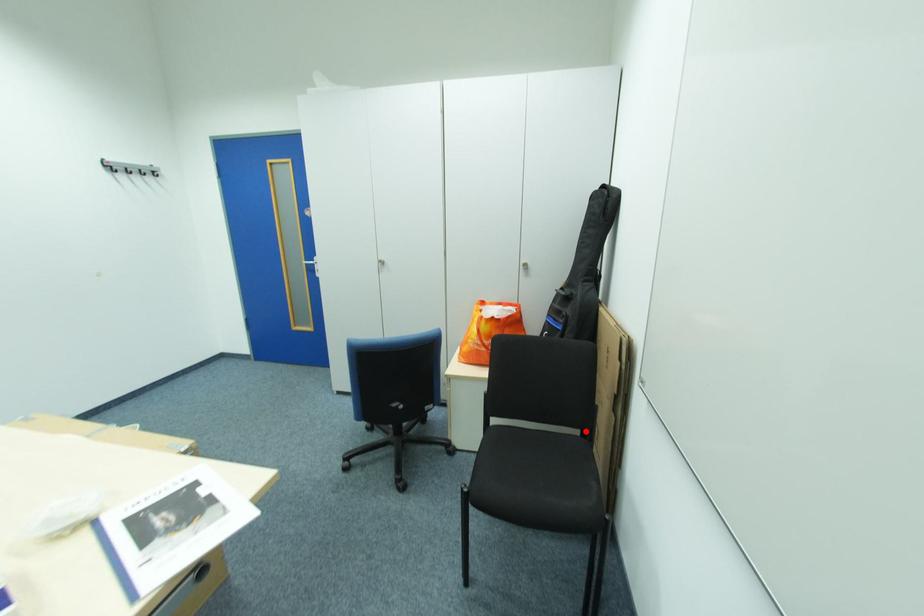
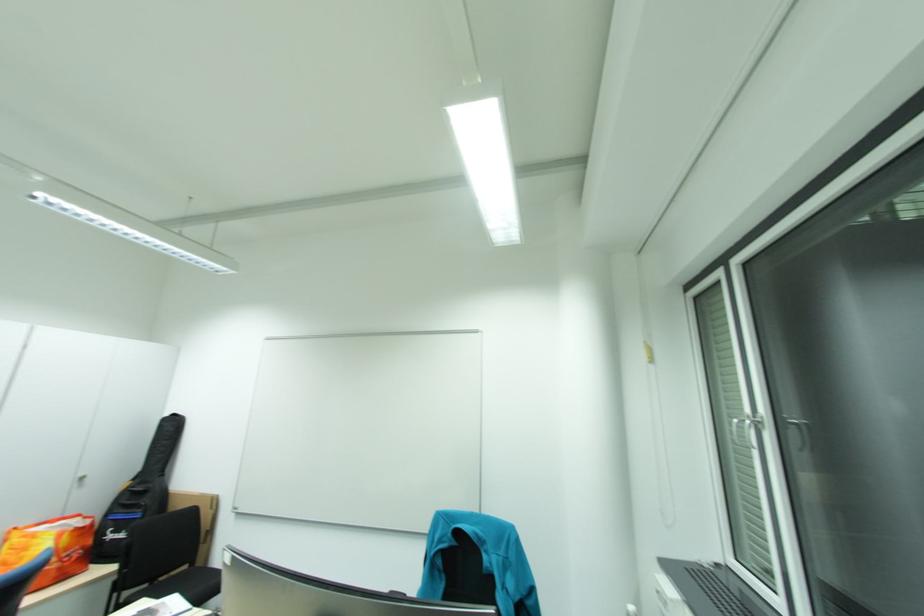
Question: A red point is marked in image1. In image2, is the corresponding 3D point closer to the camera or farther? Reply with the corresponding letter.

Choices:
 (A) The corresponding 3D point is closer.
 (B) The corresponding 3D point is farther.

Answer: (B)